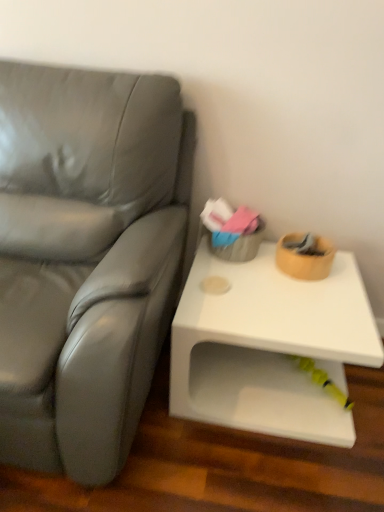
Identify the location of empty space that is ontop of white glossy table at right. This screenshot has width=384, height=512. (275, 289).